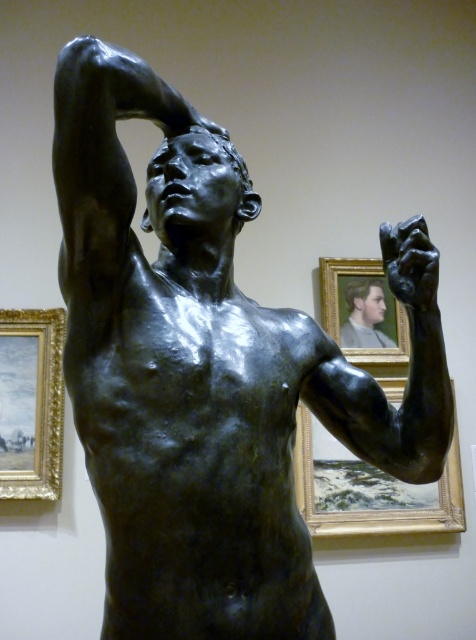
Question: Which object is farther from the camera taking this photo?

Choices:
 (A) wooden picture frame at upper right
 (B) matte gold picture frame at upper center
 (C) smooth gray face at upper right
 (D) gold/gilded picture frame at left

Answer: (C)

Question: Among these points, which one is nearest to the camera?

Choices:
 (A) (343, 342)
 (B) (46, 499)
 (C) (394, 321)
 (D) (330, 499)

Answer: (B)

Question: Is wooden picture frame at upper right bigger than smooth gray face at upper right?

Choices:
 (A) yes
 (B) no

Answer: (A)

Question: Does wooden picture frame at upper right appear on the left side of smooth gray face at upper right?

Choices:
 (A) yes
 (B) no

Answer: (B)

Question: Is wooden picture frame at upper right smaller than matte gold picture frame at upper center?

Choices:
 (A) yes
 (B) no

Answer: (B)

Question: Which point is farther to the camera?

Choices:
 (A) gold/gilded picture frame at left
 (B) matte gold picture frame at upper center

Answer: (B)